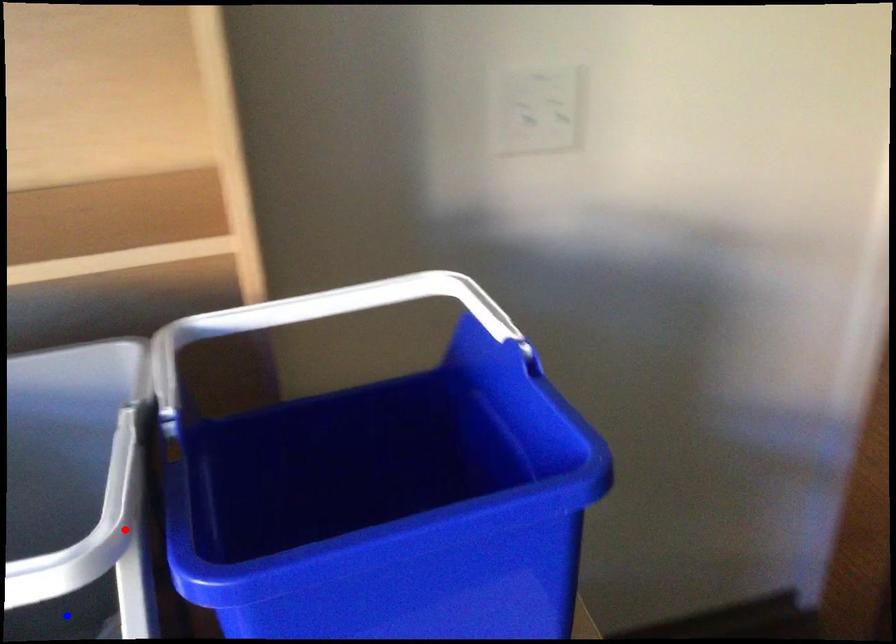
Question: In the image, two points are highlighted. Which point is nearer to the camera? Reply with the corresponding letter.

Choices:
 (A) blue point
 (B) red point

Answer: (A)